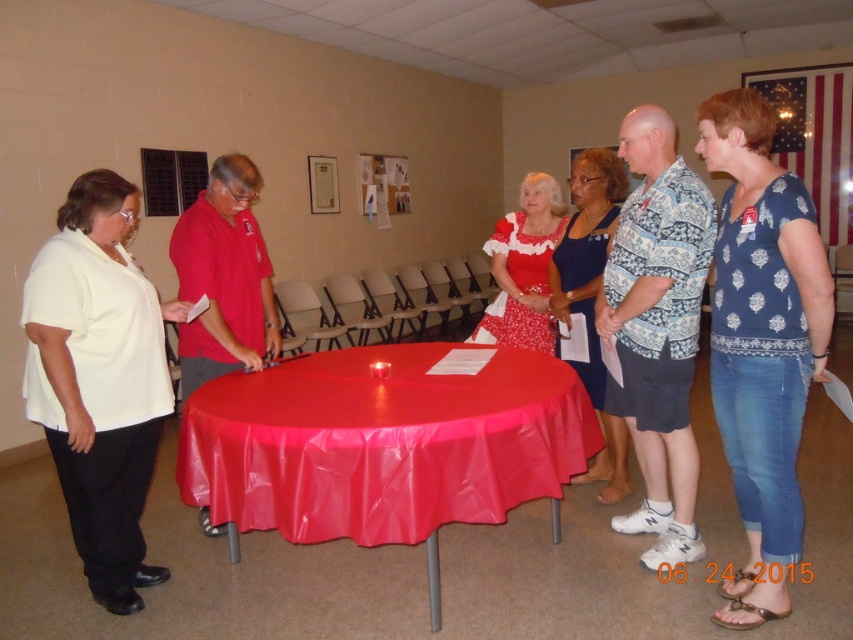
Where is the shiny plastic tablecloth at center located in the image?

The shiny plastic tablecloth at center is located at point (383,445) in the image.

You are standing at the center of the room. Which direction should you walk to reach the point marked at coordinate (383, 445)?

The point marked at coordinate (383, 445) is on the shiny plastic tablecloth at center, so you are already at the center of the room where the point is located.

Based on the scene description, where exactly is the shiny plastic tablecloth at center located in terms of coordinates?

The shiny plastic tablecloth at center is located at coordinates point (x=383, y=445).